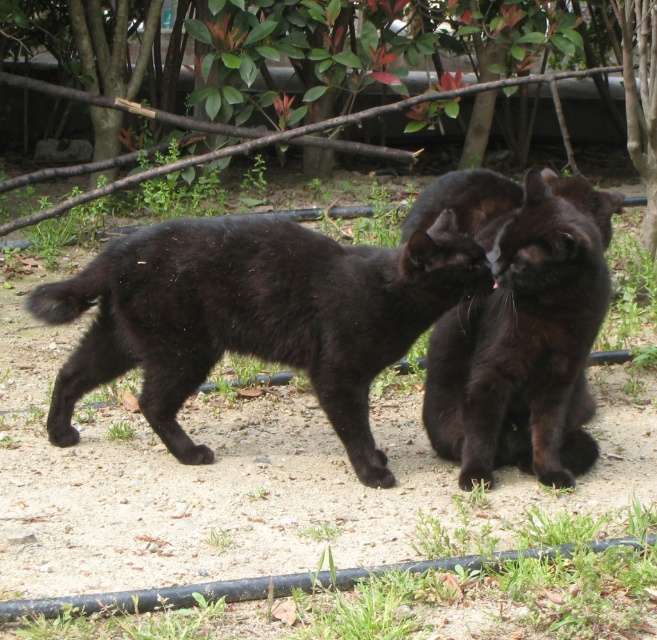
Question: Which of the following is the farthest from the observer?

Choices:
 (A) (419, 266)
 (B) (562, 468)

Answer: (B)

Question: Which object is closer to the camera taking this photo?

Choices:
 (A) matte black cat at center
 (B) shiny black cat at center

Answer: (B)

Question: Can you confirm if matte black cat at center is positioned above shiny black cat at center?

Choices:
 (A) yes
 (B) no

Answer: (B)

Question: Considering the relative positions of matte black cat at center and shiny black cat at center in the image provided, where is matte black cat at center located with respect to shiny black cat at center?

Choices:
 (A) below
 (B) above

Answer: (A)

Question: Does matte black cat at center appear on the left side of shiny black cat at center?

Choices:
 (A) no
 (B) yes

Answer: (B)

Question: Which object is farther from the camera taking this photo?

Choices:
 (A) matte black cat at center
 (B) shiny black cat at center

Answer: (A)